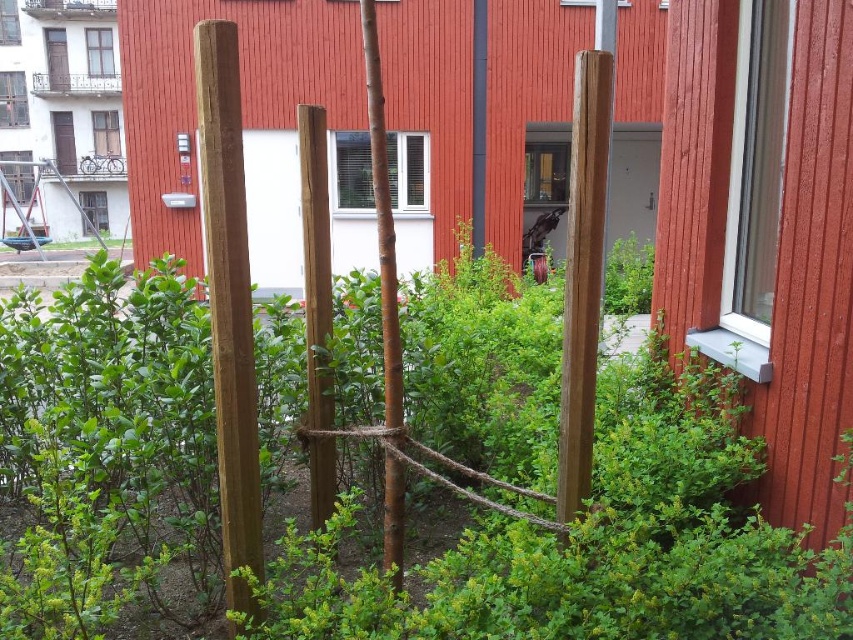
Question: Does natural wood pole at center have a greater width compared to smooth brown pole at center?

Choices:
 (A) no
 (B) yes

Answer: (B)

Question: Does natural wood pole at center appear on the right side of smooth brown pole at center?

Choices:
 (A) no
 (B) yes

Answer: (A)

Question: Among these points, which one is nearest to the camera?

Choices:
 (A) click(218, 340)
 (B) click(585, 51)

Answer: (A)

Question: Which object appears closest to the camera in this image?

Choices:
 (A) natural wood pole at center
 (B) smooth brown pole at center

Answer: (A)

Question: Is natural wood pole at center positioned before smooth brown pole at center?

Choices:
 (A) no
 (B) yes

Answer: (B)